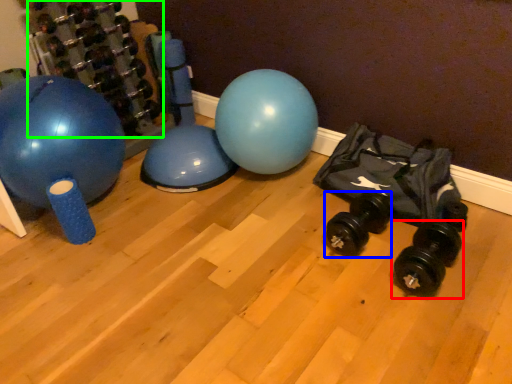
Question: Which object is positioned closest to dumbbell (highlighted by a red box)? Select from dumbbell (highlighted by a blue box) and dumbbell (highlighted by a green box).

Choices:
 (A) dumbbell
 (B) dumbbell

Answer: (A)